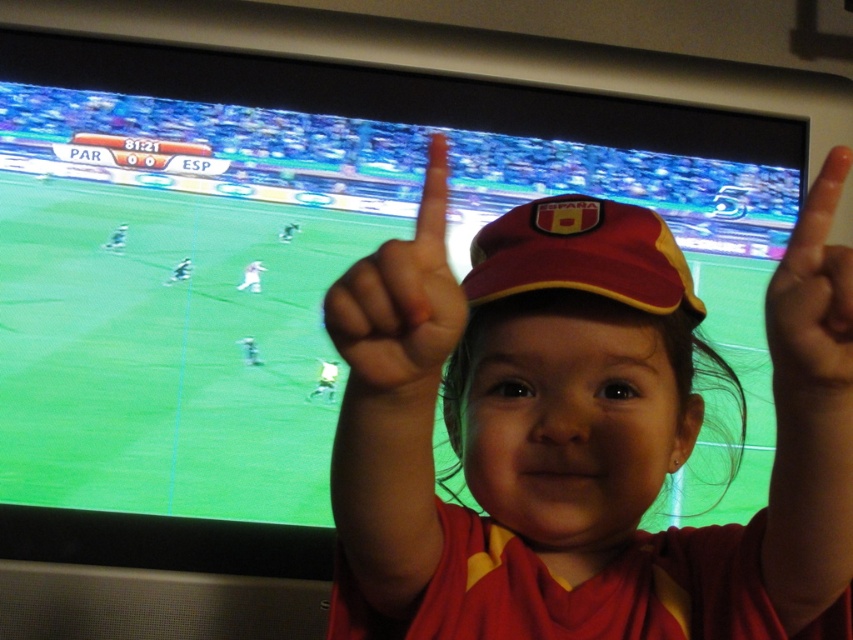
Question: Considering the relative positions of matte red cap at center and orange matte finger at upper right in the image provided, where is matte red cap at center located with respect to orange matte finger at upper right?

Choices:
 (A) above
 (B) below

Answer: (B)

Question: Considering the real-world distances, which object is closest to the orange matte finger at upper right?

Choices:
 (A) matte red finger at center
 (B) matte red cap at center

Answer: (B)

Question: Which point is farther to the camera?

Choices:
 (A) matte red cap at center
 (B) orange matte finger at upper right
 (C) matte red finger at center
 (D) matte red baseball cap at center

Answer: (D)

Question: Which point appears farthest from the camera in this image?

Choices:
 (A) (x=489, y=282)
 (B) (x=440, y=600)
 (C) (x=387, y=285)

Answer: (A)

Question: Can you confirm if matte red cap at center is bigger than matte red baseball cap at center?

Choices:
 (A) no
 (B) yes

Answer: (B)

Question: Does matte red cap at center have a lesser width compared to matte red finger at center?

Choices:
 (A) yes
 (B) no

Answer: (B)